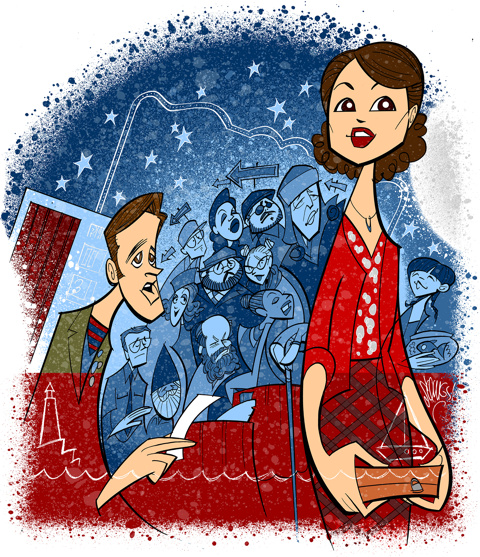
Identify the location of lock. The height and width of the screenshot is (557, 480). pos(418,487).